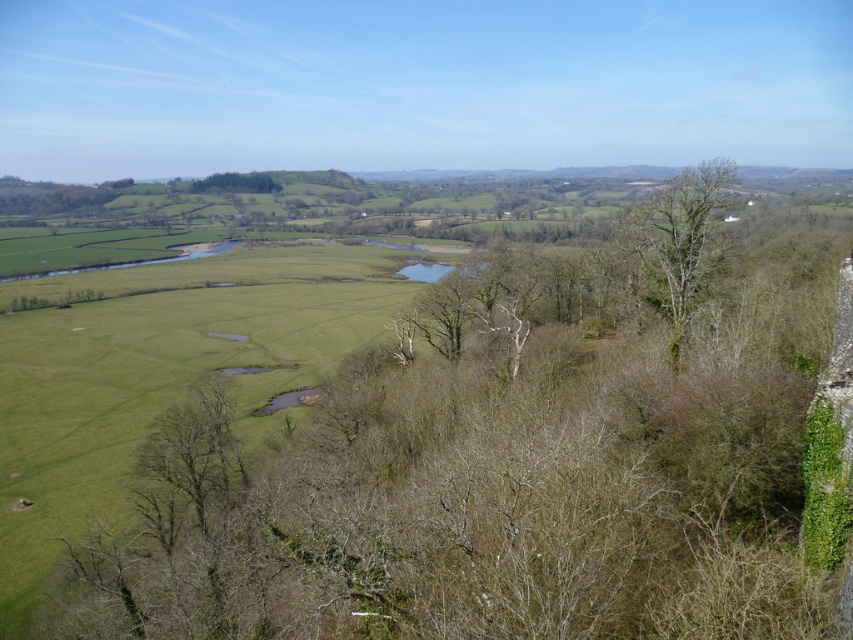
You are standing in the middle of the dense cluster of leafless trees in the foreground of the rural landscape. You want to walk straight ahead to the middle ground where the green fields are. Which direction should you walk to avoid the bare branches at center located at point (521, 461)?

Since the bare branches at center are located at point (521, 461), you should walk in a direction that avoids that specific coordinate. However, without additional spatial information about the layout of the trees or obstacles, it is not possible to determine the exact direction to avoid them. Please provide more details about the surrounding objects or their positions relative to your current location.

You are an artist trying to capture this rural landscape. You notice two trees in the scene, the bare branches at center and the bare wood tree at right. Which one would you depict as bigger in your painting?

The bare branches at center is larger in size than the bare wood tree at right, so you should depict the bare branches at center as bigger in your painting.

You are standing in the middle of the rural landscape and want to walk to the closest tree. Which tree should you head towards, the bare branches at center or the bare wood tree at right?

The bare branches at center is 21.48 meters away from the bare wood tree at right, so you should head towards whichever is closer. However, the description does not specify which one is closer to your current position in the middle. Without additional distance information from your location to each tree, it is impossible to determine which is nearer.